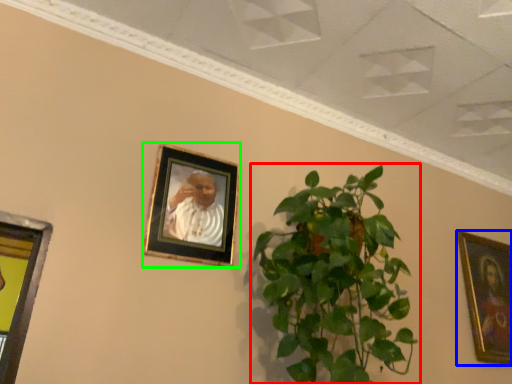
Question: Estimate the real-world distances between objects in this image. Which object is closer to houseplant (highlighted by a red box), picture frame (highlighted by a blue box) or picture frame (highlighted by a green box)?

Choices:
 (A) picture frame
 (B) picture frame

Answer: (B)